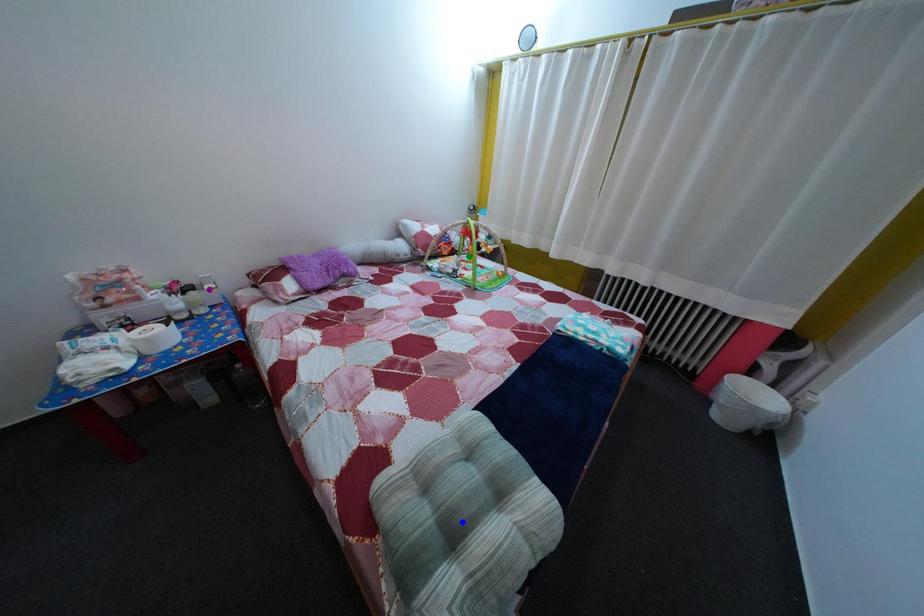
Looking at this image, order these from farthest to nearest:
green point | purple point | blue point

green point → purple point → blue point